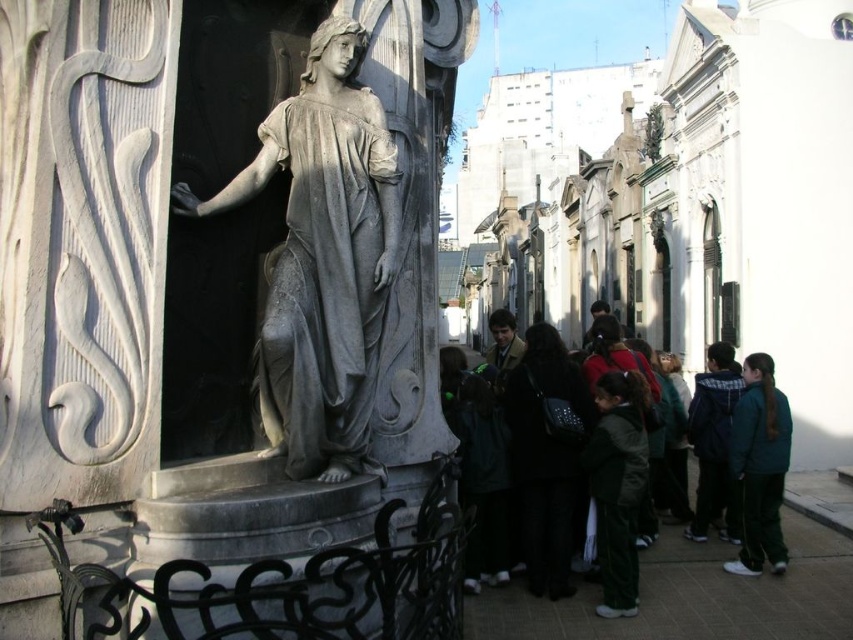
From the picture: Is gray stone statue at center to the right of green fabric jackets at lower right from the viewer's perspective?

No, gray stone statue at center is not to the right of green fabric jackets at lower right.

Is point (335, 160) more distant than point (578, 428)?

No, it is not.

Which is behind, point (323, 225) or point (556, 488)?

Point (556, 488)

At what (x,y) coordinates should I click in order to perform the action: click on gray stone statue at center. Please return your answer as a coordinate pair (x, y). This screenshot has height=640, width=853. Looking at the image, I should click on (322, 259).

In the scene shown: Can you confirm if green fabric jacket at lower right is positioned below dark blue jacket at center?

Yes.

Does point (741, 404) come in front of point (715, 342)?

Yes, point (741, 404) is in front of point (715, 342).

Between point (781, 445) and point (695, 531), which one is positioned behind?

The point (695, 531) is more distant.

Locate an element on the screen. The height and width of the screenshot is (640, 853). green fabric jacket at lower right is located at coordinates (759, 467).

Is point (345, 99) behind point (724, 412)?

No.

Does gray stone statue at center have a greater width compared to dark blue jacket at center?

No.

Find the location of a particular element. gray stone statue at center is located at coordinates (322, 259).